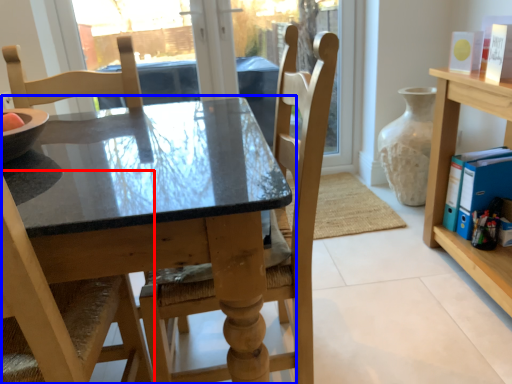
Question: Which object appears farthest to the camera in this image, chair (highlighted by a red box) or table (highlighted by a blue box)?

Choices:
 (A) chair
 (B) table

Answer: (B)